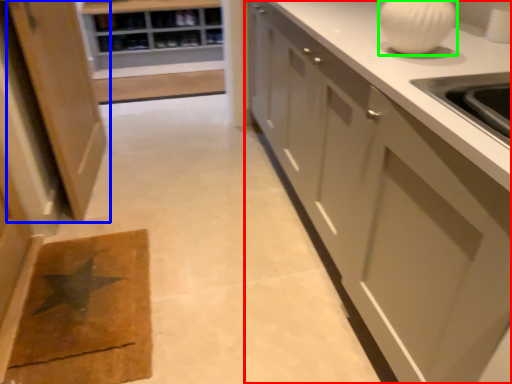
Question: Which object is positioned closest to cabinetry (highlighted by a red box)? Select from cabinetry (highlighted by a blue box) and marble (highlighted by a green box).

Choices:
 (A) cabinetry
 (B) marble

Answer: (B)